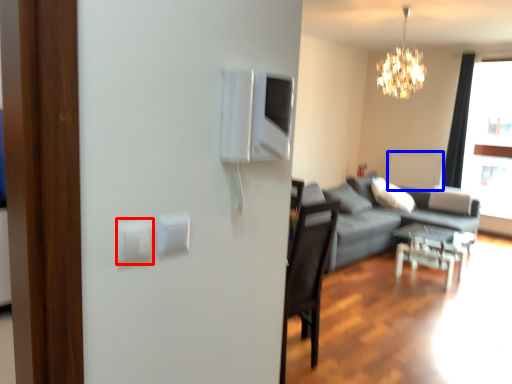
Question: Among these objects, which one is farthest to the camera, light switch (highlighted by a red box) or radiator (highlighted by a blue box)?

Choices:
 (A) light switch
 (B) radiator

Answer: (B)